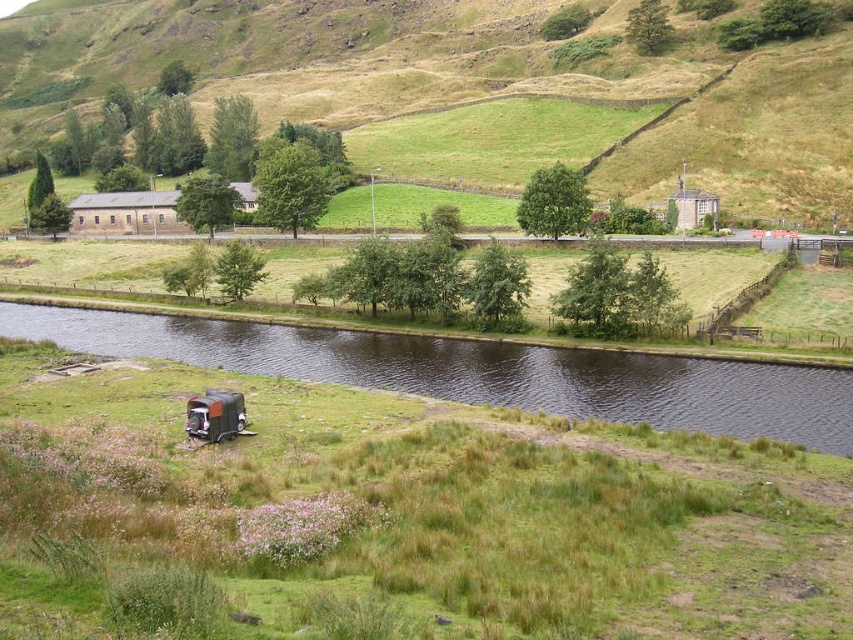
You are standing on the green grassy field at lower center and want to climb to the green grassy hillside at upper center. Which direction should you move to reach the higher elevation?

You should move upward from the green grassy field at lower center towards the green grassy hillside at upper center since the hillside is higher in elevation.

You are a hiker who wants to cross from the green grassy field at lower center to the opposite side of the dark brown water at center. Is the waterway between them passable for walking?

The green grassy field at lower center is below dark brown water at center, meaning the waterway is between them. Since the water is dark brown and described as a narrow waterway in the scene, it might be shallow enough to walk across, but caution is advised due to possible slippery conditions.